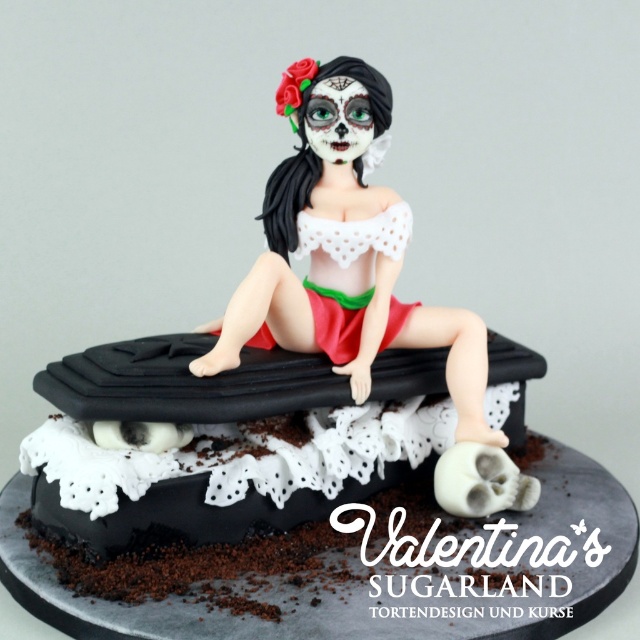
Who is taller, black glossy chocolate cake at center or matte white sugar figure at center?

matte white sugar figure at center is taller.

Can you confirm if black glossy chocolate cake at center is positioned below matte white sugar figure at center?

Correct, black glossy chocolate cake at center is located below matte white sugar figure at center.

Which is in front, point (205, 452) or point (266, 256)?

Point (205, 452)

At what (x,y) coordinates should I click in order to perform the action: click on black glossy chocolate cake at center. Please return your answer as a coordinate pair (x, y). Looking at the image, I should click on point(195,464).